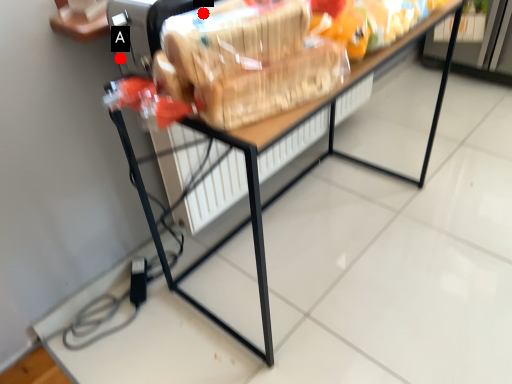
Question: Two points are circled on the image, labeled by A and B beside each circle. Which point is closer to the camera taking this photo?

Choices:
 (A) A is closer
 (B) B is closer

Answer: (B)